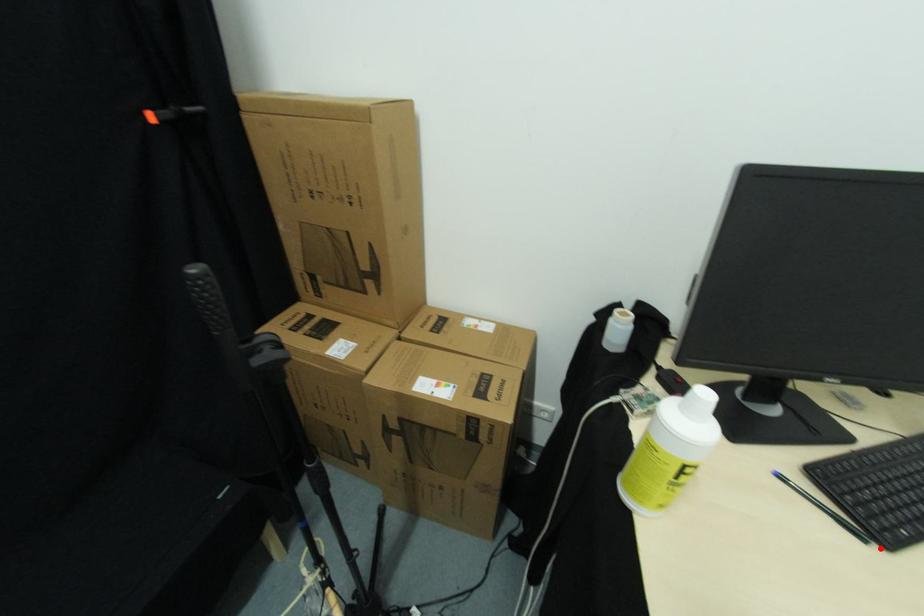
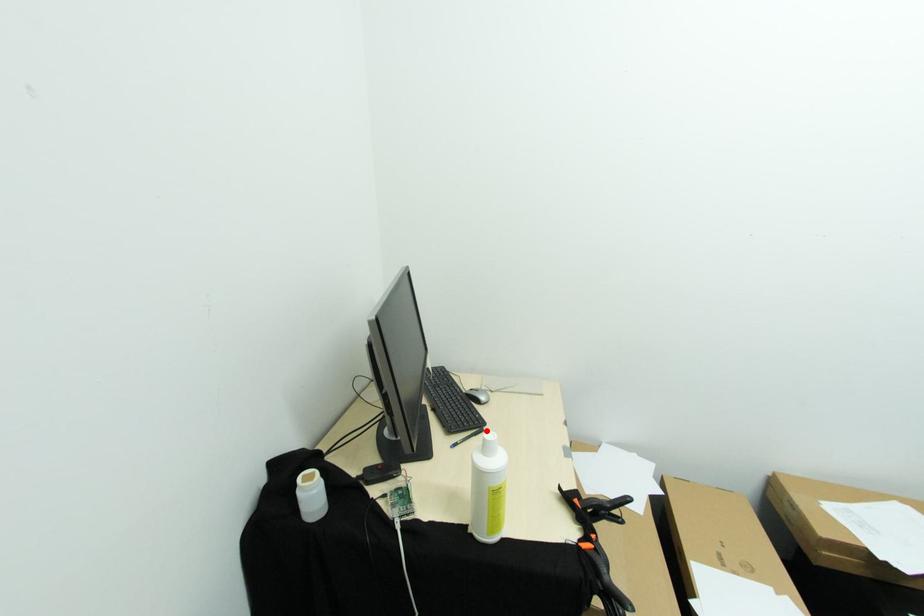
I am providing you with two images of the same scene from different viewpoints. A red point is marked on the first image and another point is marked on the second image. Does the point marked in image1 correspond to the same location as the one in image2?

Yes